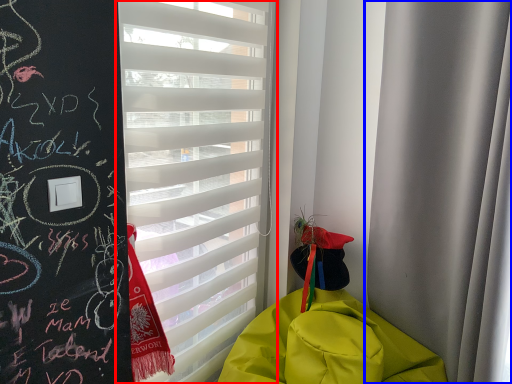
Question: Among these objects, which one is nearest to the camera, window blind (highlighted by a red box) or curtain (highlighted by a blue box)?

Choices:
 (A) window blind
 (B) curtain

Answer: (B)